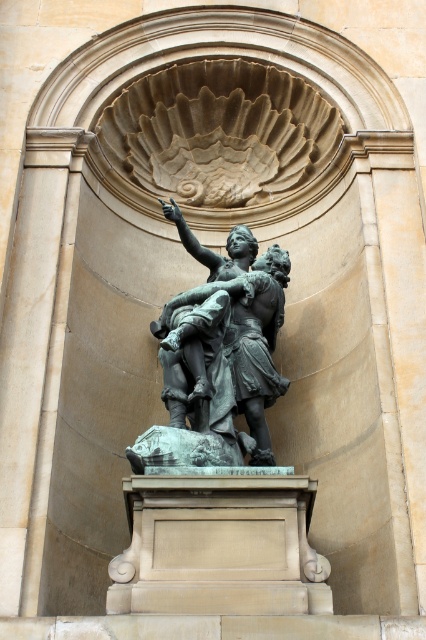
Question: Is bronze statue at center positioned at the back of smooth beige stone pillar at center?

Choices:
 (A) yes
 (B) no

Answer: (B)

Question: Can you confirm if bronze statue at center is positioned to the right of smooth beige stone pillar at center?

Choices:
 (A) no
 (B) yes

Answer: (B)

Question: Does bronze statue at center appear under smooth beige stone pillar at center?

Choices:
 (A) no
 (B) yes

Answer: (B)

Question: Which of the following is the farthest from the observer?

Choices:
 (A) smooth beige stone pillar at center
 (B) bronze statue at center

Answer: (A)

Question: Which object is farther from the camera taking this photo?

Choices:
 (A) smooth beige stone pillar at center
 (B) bronze statue at center

Answer: (A)